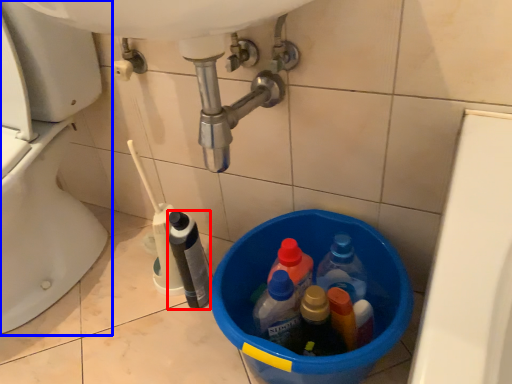
Question: Which point is further to the camera, bottle (highlighted by a red box) or toilet (highlighted by a blue box)?

Choices:
 (A) bottle
 (B) toilet

Answer: (A)